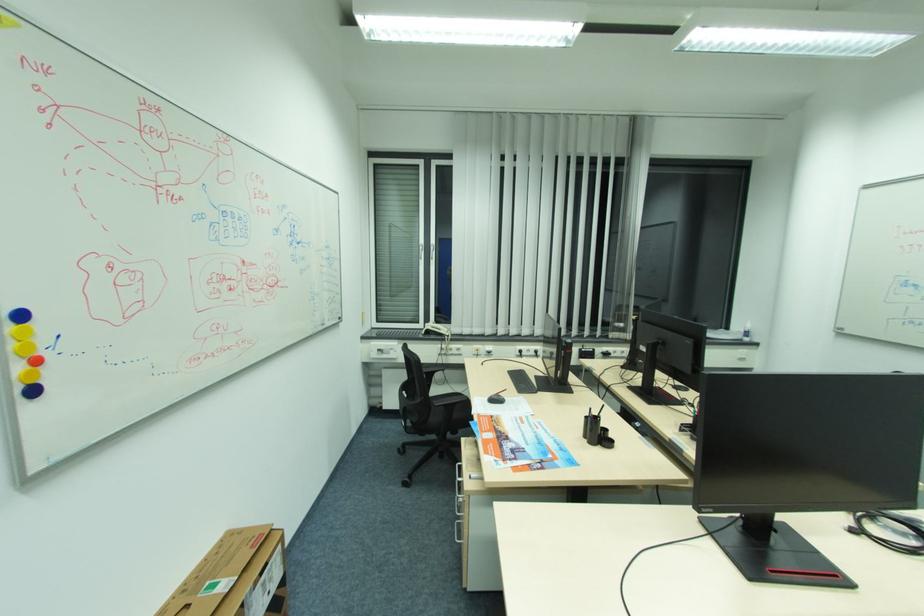
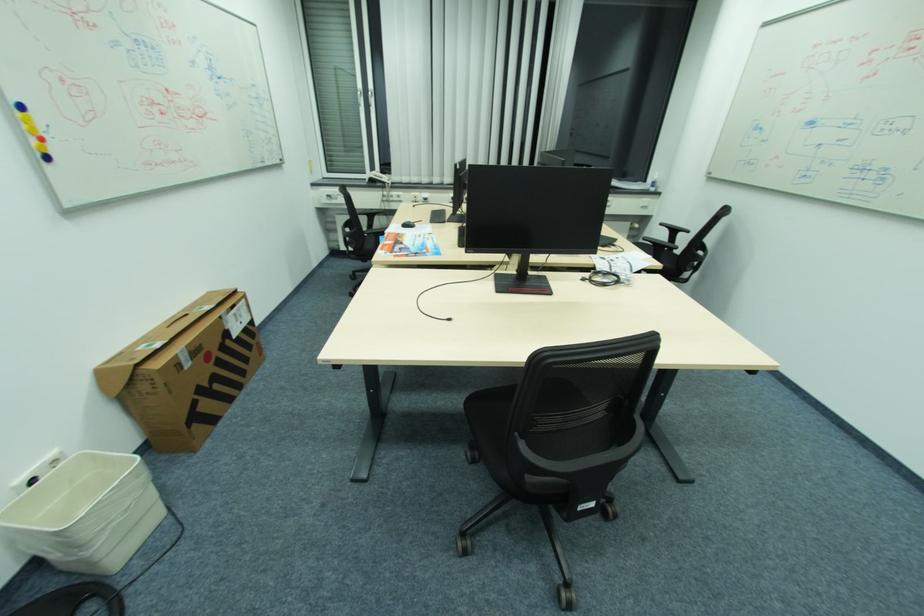
Where in the second image is the point corresponding to point (42, 362) from the first image?

(44, 140)